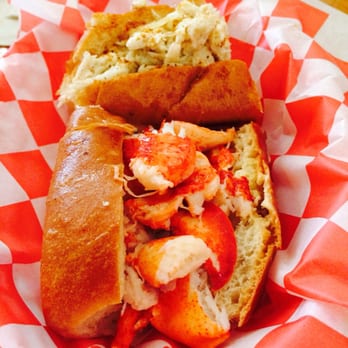
At what (x,y) coordinates should I click in order to perform the action: click on sheet. Please return your answer as a coordinate pair (x, y). The image size is (348, 348). Looking at the image, I should click on (319, 223).